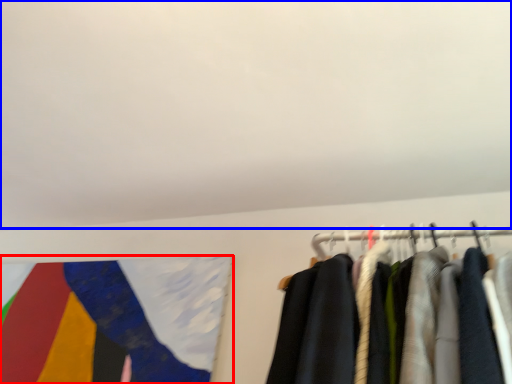
Question: Which point is closer to the camera, flag (highlighted by a red box) or backdrop (highlighted by a blue box)?

Choices:
 (A) flag
 (B) backdrop

Answer: (B)